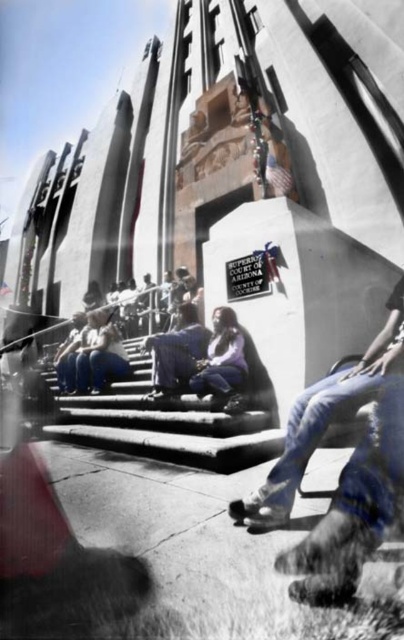
Looking at this image, which of these two, smooth concrete stairs at center or denim pants at center, stands taller?

With more height is denim pants at center.

Which is more to the left, smooth concrete stairs at center or denim pants at center?

From the viewer's perspective, smooth concrete stairs at center appears more on the left side.

Identify the location of smooth concrete stairs at center. (172, 420).

Does denim pants at center appear under denim jacket at center?

Yes.

From the picture: Is denim pants at center smaller than denim jacket at center?

Actually, denim pants at center might be larger than denim jacket at center.

This screenshot has height=640, width=404. In order to click on denim pants at center in this screenshot , I will do `click(324, 419)`.

Is smooth concrete stairs at center closer to camera compared to denim jacket at center?

Yes, smooth concrete stairs at center is in front of denim jacket at center.

What do you see at coordinates (172, 420) in the screenshot? I see `smooth concrete stairs at center` at bounding box center [172, 420].

The height and width of the screenshot is (640, 404). I want to click on smooth concrete stairs at center, so click(172, 420).